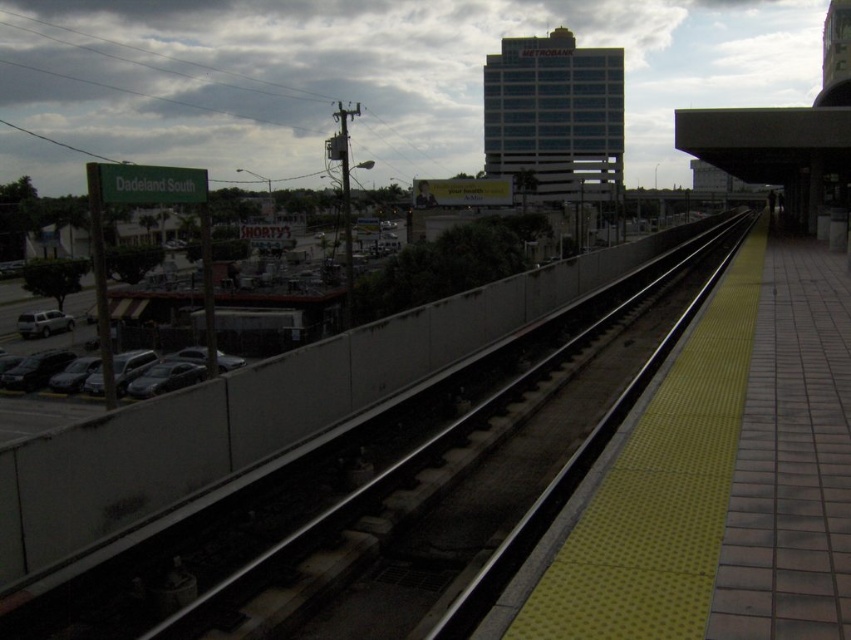
Question: Among these points, which one is farthest from the camera?

Choices:
 (A) (201, 568)
 (B) (87, 378)

Answer: (B)

Question: Is black asphalt train track at center further to camera compared to dark gray metallic car at left?

Choices:
 (A) yes
 (B) no

Answer: (B)

Question: Is black asphalt train track at center wider than dark gray metallic car at left?

Choices:
 (A) no
 (B) yes

Answer: (B)

Question: Which of the following is the farthest from the observer?

Choices:
 (A) (4, 596)
 (B) (191, 362)

Answer: (B)

Question: Where is black asphalt train track at center located in relation to satin silver suv at left in the image?

Choices:
 (A) above
 (B) below

Answer: (A)

Question: Considering the real-world distances, which object is farthest from the satin silver suv at left?

Choices:
 (A) black asphalt train track at center
 (B) dark gray metallic car at left

Answer: (A)